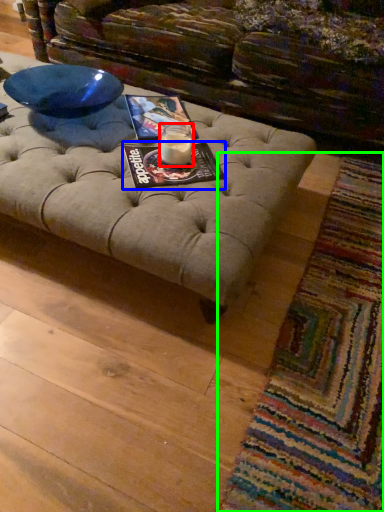
Question: Estimate the real-world distances between objects in this image. Which object is farther from candle holder (highlighted by a red box), magazine (highlighted by a blue box) or mat (highlighted by a green box)?

Choices:
 (A) magazine
 (B) mat

Answer: (B)